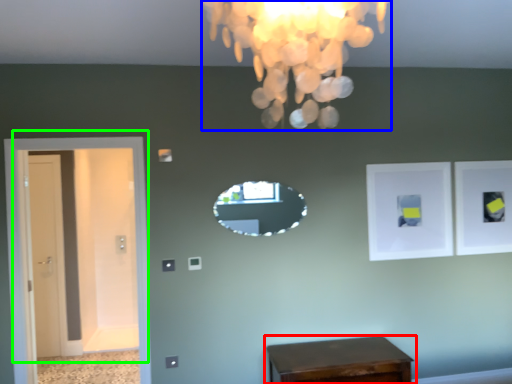
Question: Considering the real-world distances, which object is closest to table (highlighted by a red box)? lamp (highlighted by a blue box) or door (highlighted by a green box).

Choices:
 (A) lamp
 (B) door

Answer: (B)